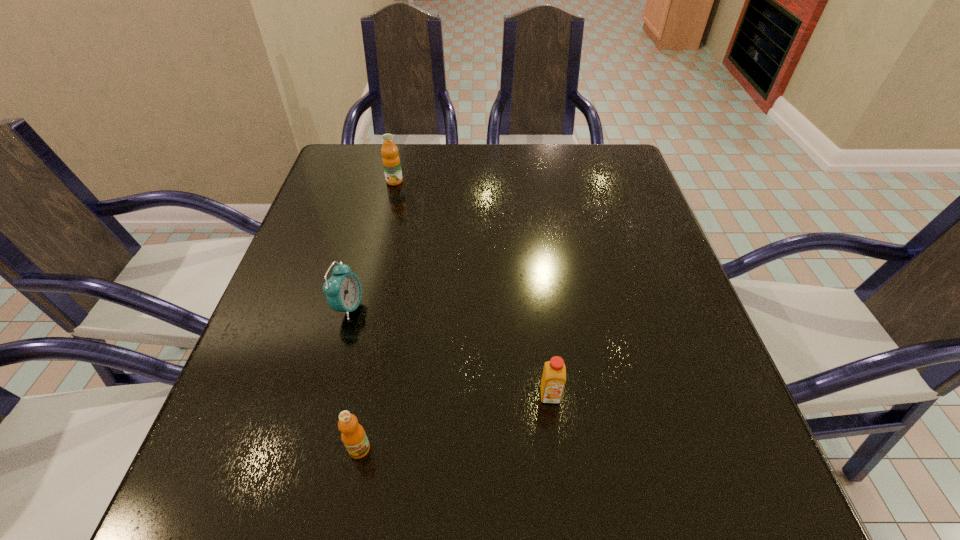
Locate an element on the screen. The width and height of the screenshot is (960, 540). free spot between the tallest orange juice and the second farthest object is located at coordinates (372, 244).

Where is `vacant space that's between the farthest object and the second farthest orange juice`? The width and height of the screenshot is (960, 540). vacant space that's between the farthest object and the second farthest orange juice is located at coordinates pyautogui.click(x=472, y=288).

At what (x,y) coordinates should I click in order to perform the action: click on empty space that is in between the leftmost orange juice and the second farthest orange juice. Please return your answer as a coordinate pair (x, y). The width and height of the screenshot is (960, 540). Looking at the image, I should click on (472, 288).

Locate an element on the screen. free space between the second orange juice from right to left and the farthest orange juice is located at coordinates 377,315.

At what (x,y) coordinates should I click in order to perform the action: click on free point between the rightmost object and the farthest object. Please return your answer as a coordinate pair (x, y). The image size is (960, 540). Looking at the image, I should click on (472, 288).

Locate an element on the screen. Image resolution: width=960 pixels, height=540 pixels. empty space between the second farthest object and the farthest object is located at coordinates tap(372, 244).

Find the location of `vacant region between the nearest object and the alarm clock`. vacant region between the nearest object and the alarm clock is located at coordinates (354, 378).

I want to click on vacant space that's between the farthest orange juice and the nearest orange juice, so click(x=377, y=315).

You are a GUI agent. You are given a task and a screenshot of the screen. Output one action in this format:
    pyautogui.click(x=<x>, y=<y>)
    Task: Click on the vacant space that's between the tallest orange juice and the third nearest object
    
    Given the screenshot: What is the action you would take?
    pyautogui.click(x=372, y=244)

Where is `unoccupied position between the farthest object and the nearest object`? Image resolution: width=960 pixels, height=540 pixels. unoccupied position between the farthest object and the nearest object is located at coordinates (377, 315).